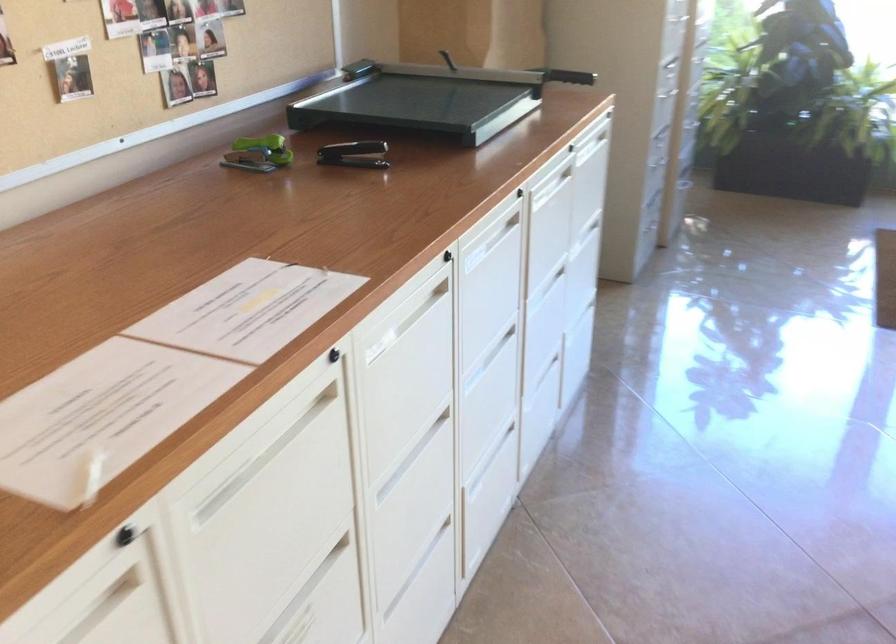
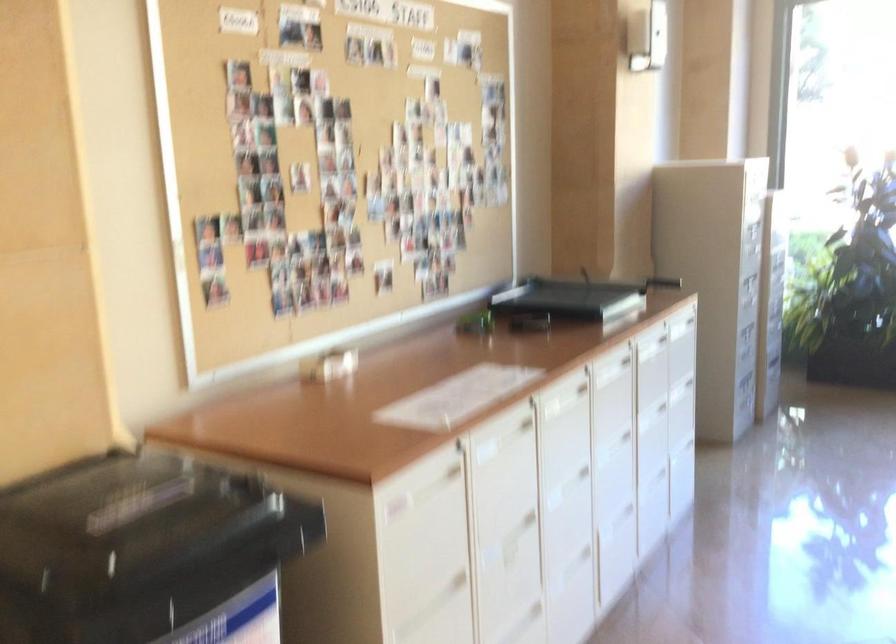
In the second image, find the point that corresponds to [563,330] in the first image.

(676, 444)